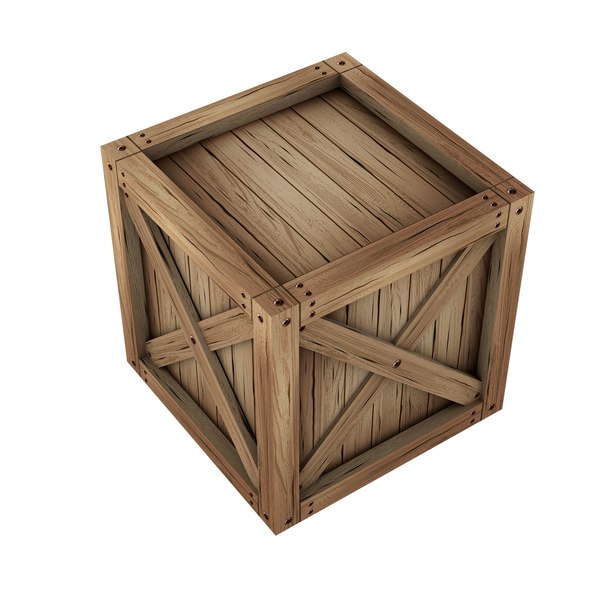
You are a GUI agent. You are given a task and a screenshot of the screen. Output one action in this format:
    pyautogui.click(x=<x>, y=<y>)
    Task: Click on the wooden crate
    
    Given the screenshot: What is the action you would take?
    pyautogui.click(x=278, y=305)